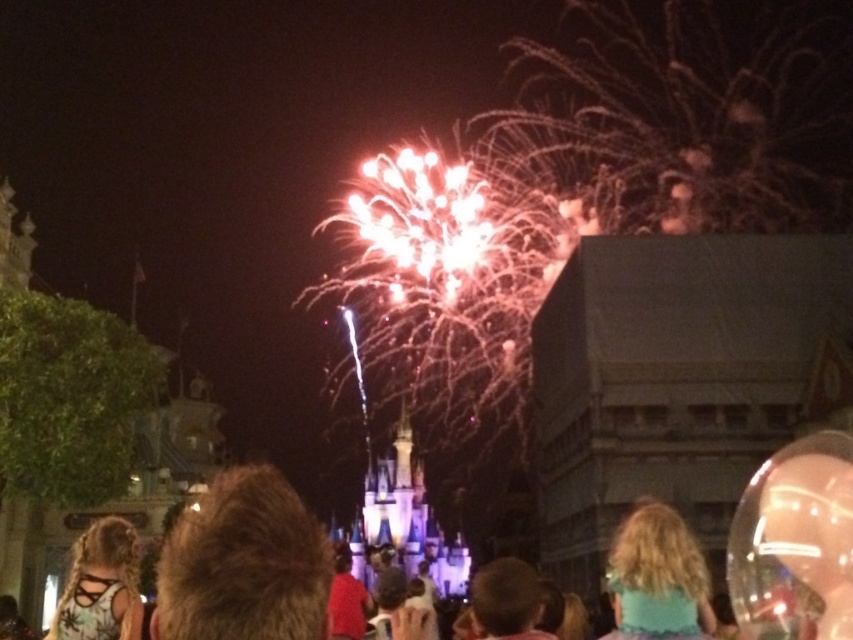
Question: Which of the following is the closest to the observer?

Choices:
 (A) brown fuzzy hair at center
 (B) brown hair at center

Answer: (A)

Question: Which object appears closest to the camera in this image?

Choices:
 (A) teal fabric hair at center
 (B) brown hair at center
 (C) brown fuzzy hair at center

Answer: (C)

Question: Can you confirm if teal fabric hair at center is thinner than brown hair at center?

Choices:
 (A) no
 (B) yes

Answer: (A)

Question: Does teal fabric hair at center appear on the right side of brown hair at center?

Choices:
 (A) no
 (B) yes

Answer: (B)

Question: Which object appears closest to the camera in this image?

Choices:
 (A) brown fuzzy hair at center
 (B) matte black tank top at lower left

Answer: (A)

Question: Is matte black tank top at lower left below brown hair at center?

Choices:
 (A) yes
 (B) no

Answer: (B)